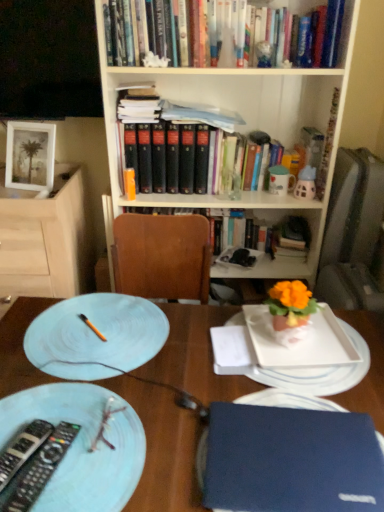
In order to click on free region under light blue ceramic plate at center-left, which is the first plate in back-to-front order (from a real-world perspective) in this screenshot , I will do `click(89, 344)`.